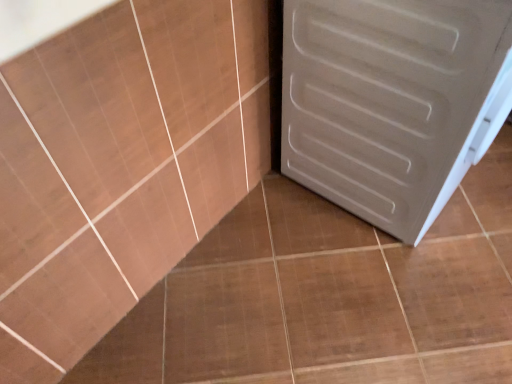
Question: Should I look upward or downward to see white matte door at right?

Choices:
 (A) down
 (B) up

Answer: (B)